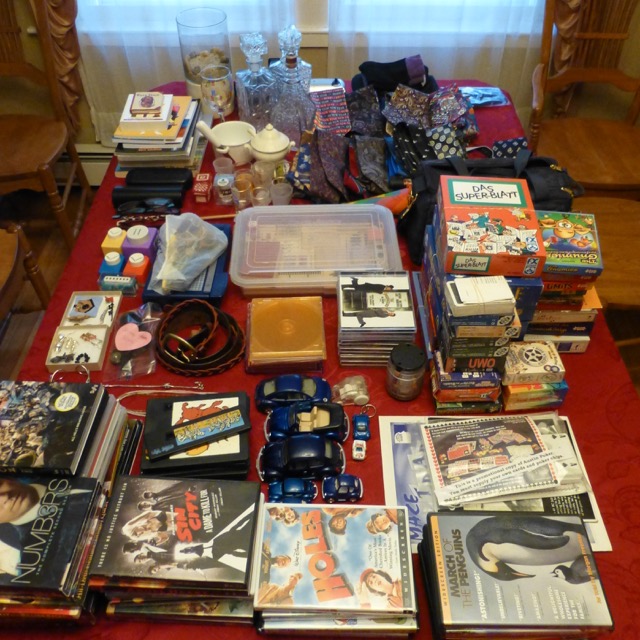
You are a GUI agent. You are given a task and a screenshot of the screen. Output one action in this format:
    pyautogui.click(x=<x>, y=<y>)
    Task: Click on the dvds
    
    Given the screenshot: What is the action you would take?
    pyautogui.click(x=210, y=522), pyautogui.click(x=60, y=516), pyautogui.click(x=52, y=458), pyautogui.click(x=312, y=572), pyautogui.click(x=476, y=573)